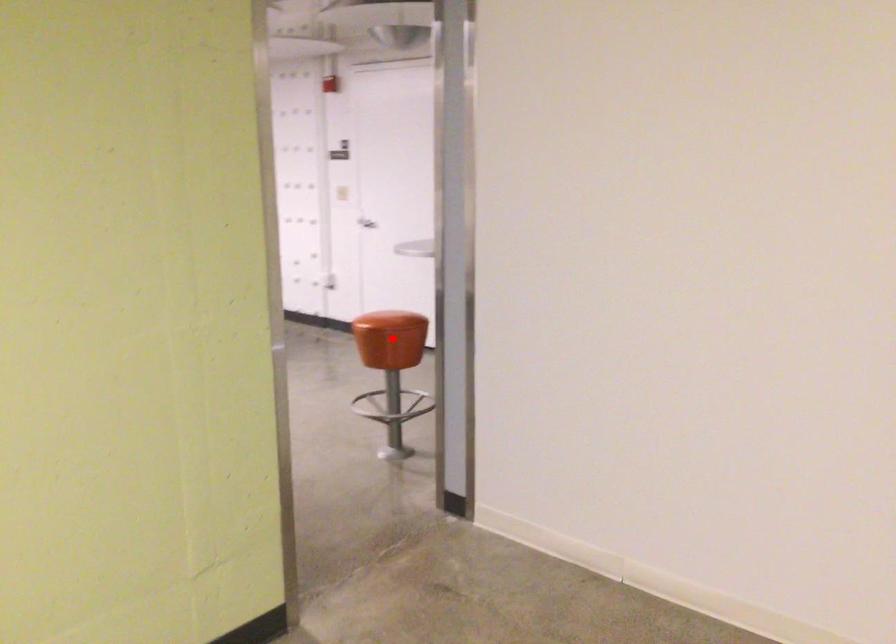
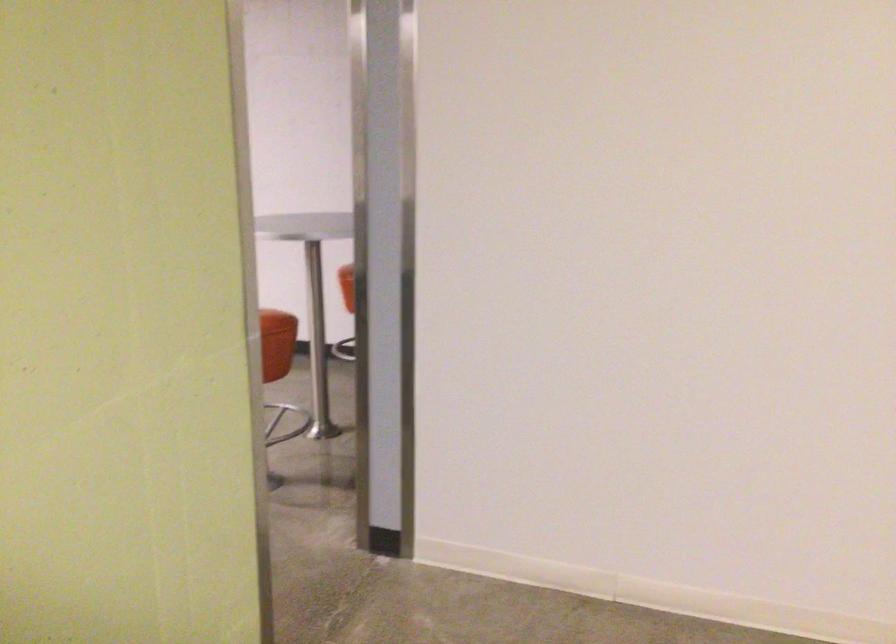
Question: I am providing you with two images of the same scene from different viewpoints. Image1 has a red point marked. In image2, the corresponding 3D location appears at what relative position? Reply with the corresponding letter.

Choices:
 (A) Closer
 (B) Farther

Answer: (A)